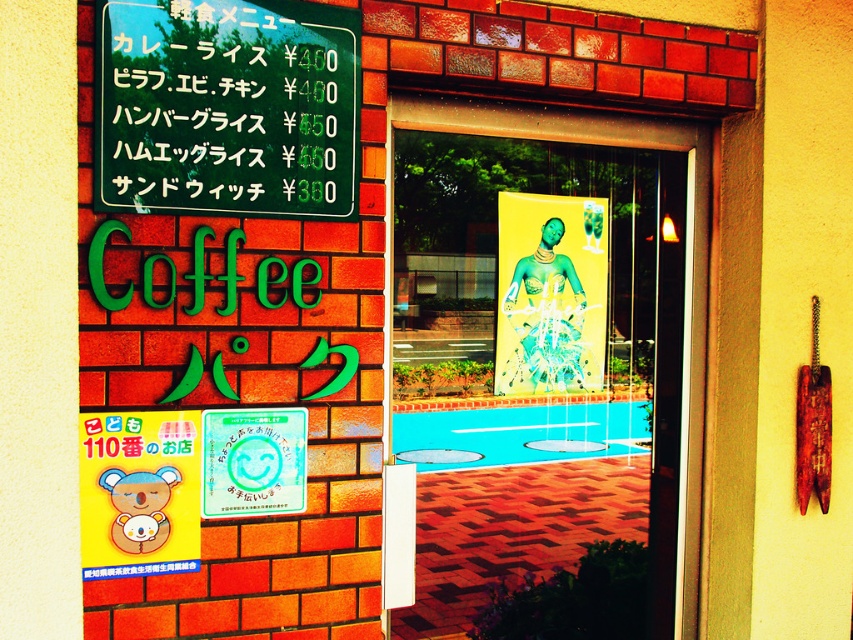
Question: Which point appears farthest from the camera in this image?

Choices:
 (A) (206, 10)
 (B) (589, 234)
 (C) (171, 548)

Answer: (B)

Question: Estimate the real-world distances between objects in this image. Which object is closer to the white glossy signboard at upper center?

Choices:
 (A) translucent glass window at center
 (B) yellow paper bear at upper left

Answer: (B)

Question: Is yellow paper bear at upper left to the right of white glossy signboard at upper center from the viewer's perspective?

Choices:
 (A) yes
 (B) no

Answer: (B)

Question: Is the position of translucent glass window at center less distant than that of yellow paper bear at upper left?

Choices:
 (A) yes
 (B) no

Answer: (B)

Question: Can you confirm if translucent glass window at center is positioned below white glossy signboard at upper center?

Choices:
 (A) yes
 (B) no

Answer: (B)

Question: Which point appears closest to the camera in this image?

Choices:
 (A) (181, 566)
 (B) (222, 476)
 (C) (457, 250)

Answer: (A)